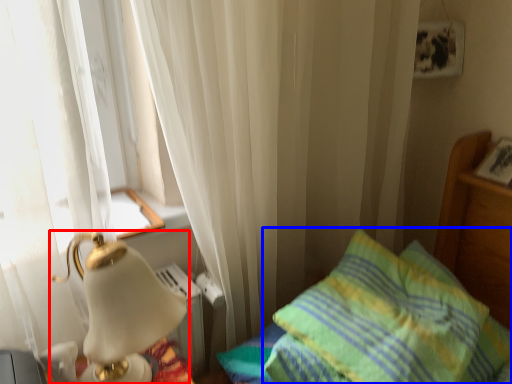
Question: Which object is further to the camera taking this photo, lamp (highlighted by a red box) or pillow (highlighted by a blue box)?

Choices:
 (A) lamp
 (B) pillow

Answer: (B)